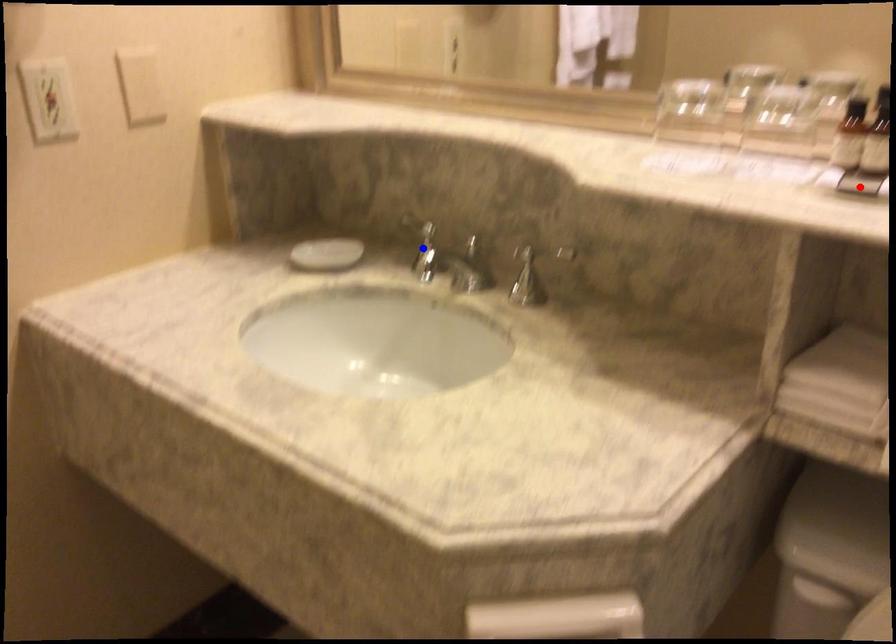
Question: Which of the two points in the image is closer to the camera?

Choices:
 (A) Blue point is closer.
 (B) Red point is closer.

Answer: (B)